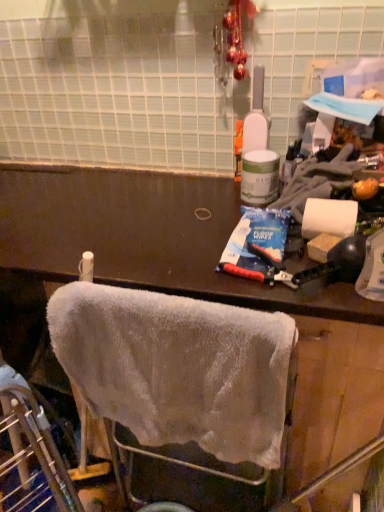
You are a GUI agent. You are given a task and a screenshot of the screen. Output one action in this format:
    pyautogui.click(x=<x>, y=<y>)
    Task: Click on the vacant region above white fluffy towel at lower left (from a real-world perspective)
    This screenshot has height=512, width=384.
    Given the screenshot: What is the action you would take?
    pyautogui.click(x=174, y=302)